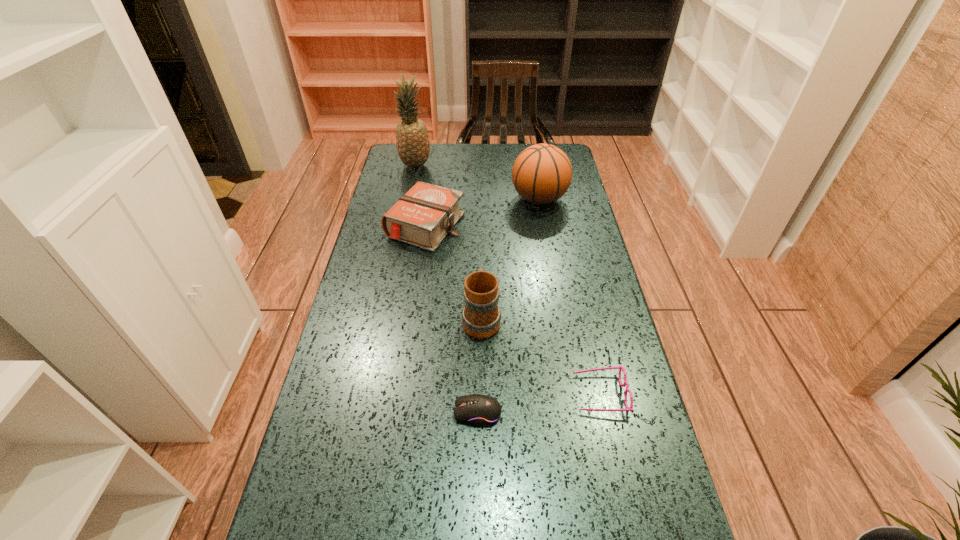
The height and width of the screenshot is (540, 960). I want to click on Bible that is positioned at the left edge, so click(x=422, y=217).

You are a GUI agent. You are given a task and a screenshot of the screen. Output one action in this format:
    pyautogui.click(x=<x>, y=<y>)
    Task: Click on the basketball located at the right edge
    This screenshot has height=540, width=960.
    Given the screenshot: What is the action you would take?
    pyautogui.click(x=542, y=173)

This screenshot has width=960, height=540. Identify the location of spectacles that is positioned at the right edge. (619, 367).

You are a GUI agent. You are given a task and a screenshot of the screen. Output one action in this format:
    pyautogui.click(x=<x>, y=<y>)
    Task: Click on the object located in the far left corner section of the desktop
    
    Given the screenshot: What is the action you would take?
    pyautogui.click(x=412, y=139)

Where is `vacant space at the left edge of the desktop`? vacant space at the left edge of the desktop is located at coordinates (394, 201).

I want to click on free space at the right edge, so click(569, 378).

Where is `vacant point located between the spectacles and the computer mouse`? The image size is (960, 540). vacant point located between the spectacles and the computer mouse is located at coordinates (539, 403).

Locate an element on the screen. free spot between the spectacles and the fifth shortest object is located at coordinates (569, 296).

At what (x,y) coordinates should I click in order to perform the action: click on vacant space that is in between the third shortest object and the basketball. Please return your answer as a coordinate pair (x, y). Looking at the image, I should click on (483, 212).

The image size is (960, 540). Identify the location of free space that is in between the third shortest object and the computer mouse. (451, 319).